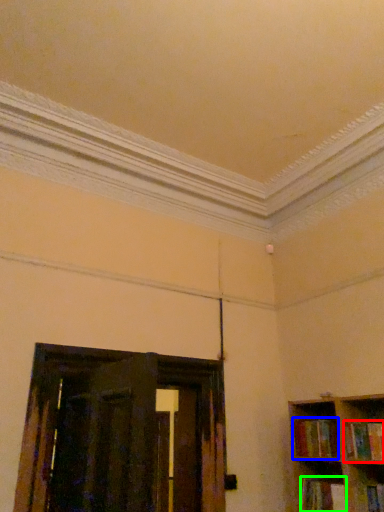
Question: Estimate the real-world distances between objects in this image. Which object is closer to book (highlighted by a red box), book (highlighted by a blue box) or book (highlighted by a green box)?

Choices:
 (A) book
 (B) book

Answer: (A)